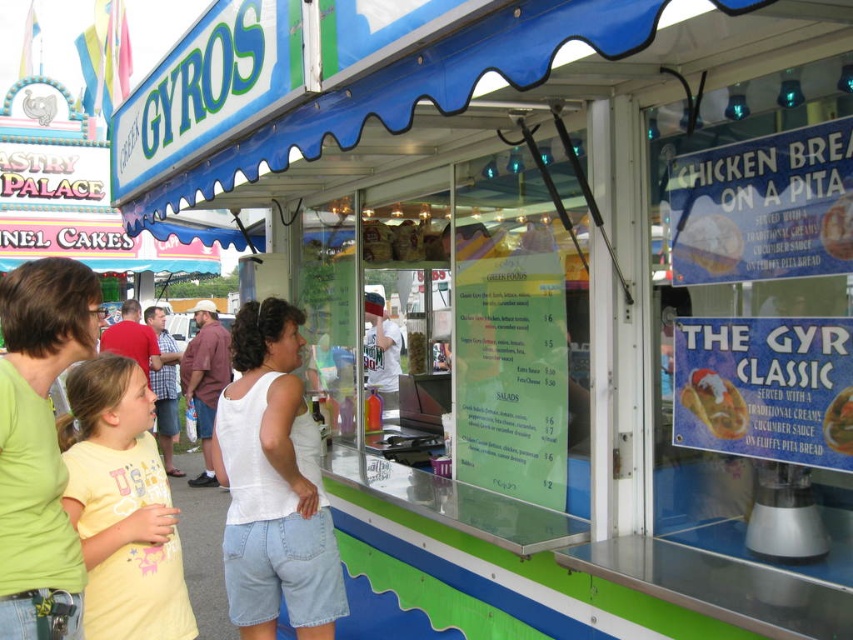
You are a customer at the GREEK GYROS stall and want to order a matte plastic chicken at center. The cashier is wearing a red shirt at center. Where should you look to place your order?

The red shirt at center is located below the matte plastic chicken at center, so you should look down towards the red shirt at center to place your order.

You are trying to decide what to wear to the fair. You have a white cotton tank top at center and a white paper chicken at center. Which item of clothing is larger?

The white cotton tank top at center is bigger than the white paper chicken at center.